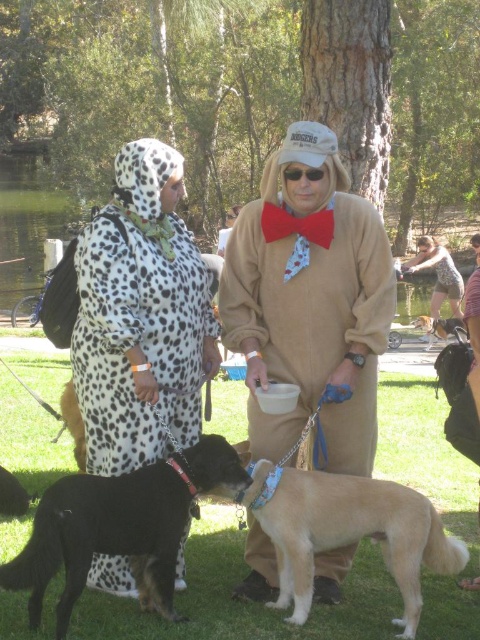
Question: Does beige plush onesie at center appear on the right side of spotted fabric dress at center?

Choices:
 (A) no
 (B) yes

Answer: (B)

Question: Does patterned fabric dress at center appear on the right side of soft brown fur at center?

Choices:
 (A) no
 (B) yes

Answer: (B)

Question: Which object appears closest to the camera in this image?

Choices:
 (A) soft brown fur at center
 (B) patterned fabric dress at center

Answer: (A)

Question: Estimate the real-world distances between objects in this image. Which object is closer to the light brown fur at center?

Choices:
 (A) spotted fabric dress at center
 (B) black fur dog at lower left
 (C) soft brown fur at center
 (D) beige plush onesie at center

Answer: (B)

Question: Does spotted fabric dress at center appear under black fur dog at lower left?

Choices:
 (A) no
 (B) yes

Answer: (A)

Question: Among these points, which one is farthest from the camera?

Choices:
 (A) (283, 348)
 (B) (75, 416)
 (C) (424, 316)

Answer: (C)